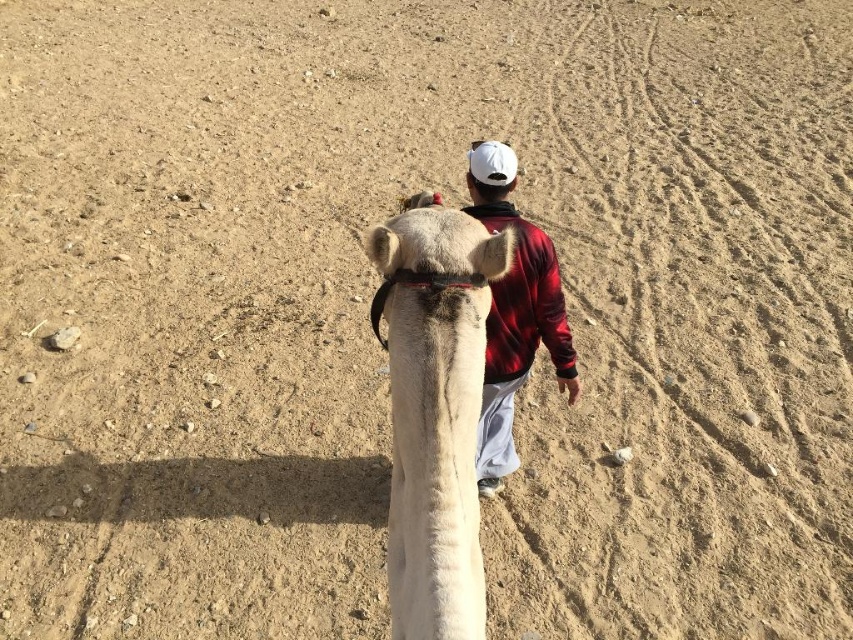
Does red plaid jacket at center appear over white matte baseball hat at upper center?

Actually, red plaid jacket at center is below white matte baseball hat at upper center.

Between red plaid jacket at center and white matte baseball hat at upper center, which one appears on the right side from the viewer's perspective?

red plaid jacket at center

Which is in front, point (519, 280) or point (480, 148)?

Positioned in front is point (480, 148).

This screenshot has width=853, height=640. Find the location of `red plaid jacket at center`. red plaid jacket at center is located at coordinates (515, 330).

Can you confirm if fuzzy beige camel at center is shorter than white matte baseball hat at upper center?

No.

Between point (415, 584) and point (494, 141), which one is positioned behind?

The point (494, 141) is behind.

This screenshot has height=640, width=853. I want to click on fuzzy beige camel at center, so click(434, 410).

Is point (467, 621) in front of point (529, 364)?

That is True.

Who is positioned more to the right, fuzzy beige camel at center or red plaid jacket at center?

Positioned to the right is red plaid jacket at center.

Is point (438, 205) positioned in front of point (502, 369)?

Yes, it is in front of point (502, 369).

You are a GUI agent. You are given a task and a screenshot of the screen. Output one action in this format:
    pyautogui.click(x=<x>, y=<y>)
    Task: Click on the fuzzy beige camel at center
    The height and width of the screenshot is (640, 853).
    Given the screenshot: What is the action you would take?
    pyautogui.click(x=434, y=410)